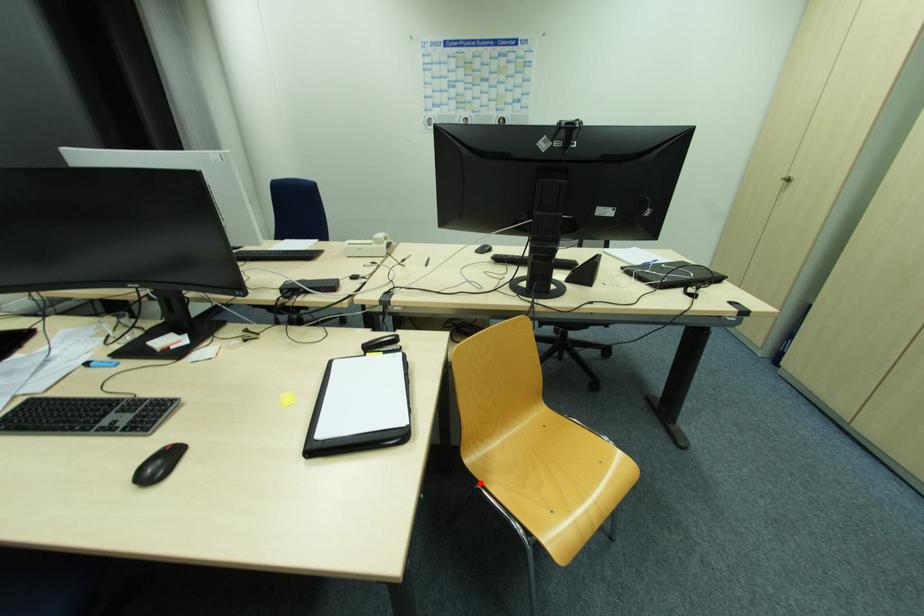
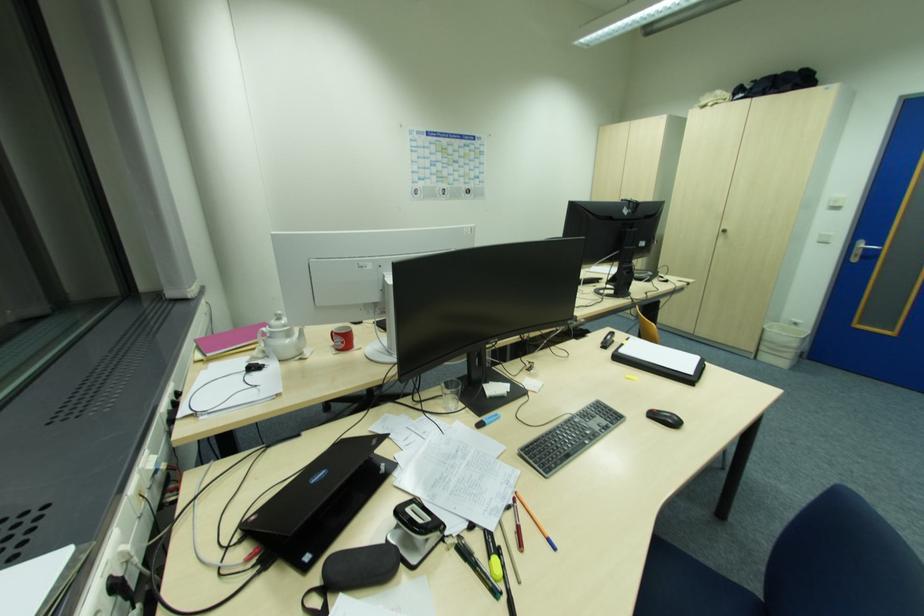
Question: I am providing you with two images of the same scene from different viewpoints. A red point is marked on the first image. Can you still see the location of the red point in image 2?

Choices:
 (A) Yes
 (B) No

Answer: (B)